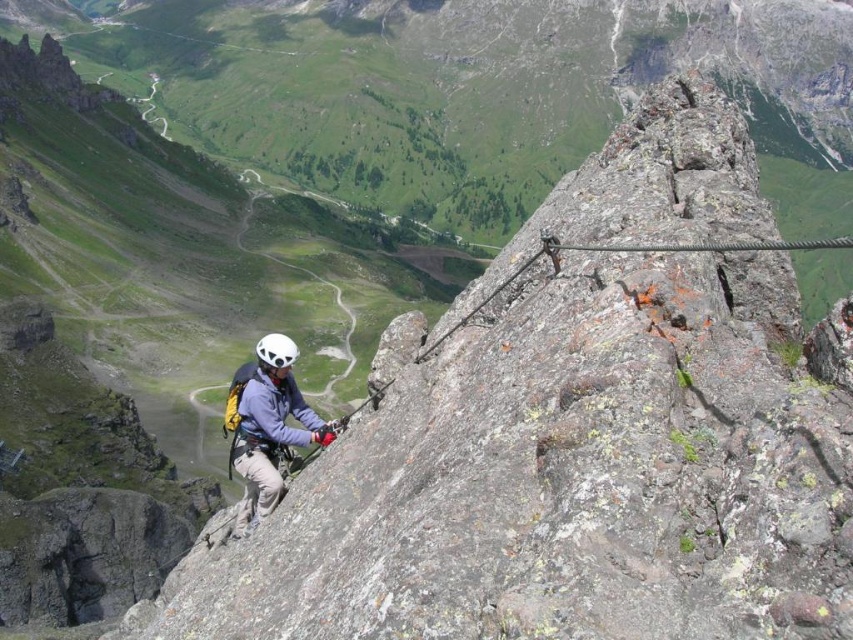
Based on the coordinates provided in the image, where is the matte gray helmet at center located?

The matte gray helmet at center is located at coordinates point (267, 424).

You are a safety inspector assessing the via ferrata route. You notice two helmets, a matte gray helmet at center and a white matte helmet at center, positioned on the rock face. Based on the spacing between them, can a standard 3.5 feet wide safety net be placed between them without overlapping either helmet?

The distance between the matte gray helmet at center and the white matte helmet at center is 9.37 feet. Since the safety net is 3.5 feet wide, there is sufficient space between the two helmets to place the net without overlapping, as 9.37 feet is greater than 3.5 feet.

You are a climber on a via ferrata route and need to move from one point to another. You are currently at point A, which is at coordinates point A at (244, 422). You want to reach point B, which is at coordinates point B at (292, 364). Based on the image, which direction should you move to get closer to point B?

Point A at (244, 422) is in front of point B at (292, 364). Therefore, to reach point B, you should move backward from your current position.